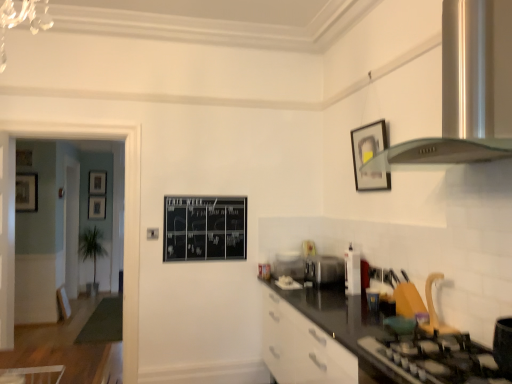
This screenshot has height=384, width=512. In order to click on wooden picture frame at left, which is the 2th picture frame in left-to-right order in this screenshot , I will do `click(26, 192)`.

You are a GUI agent. You are given a task and a screenshot of the screen. Output one action in this format:
    pyautogui.click(x=<x>, y=<y>)
    Task: Click on the black chalkboard at center
    This screenshot has height=384, width=512.
    Given the screenshot: What is the action you would take?
    pyautogui.click(x=205, y=228)

Describe the element at coordinates (97, 207) in the screenshot. I see `matte black picture frame at center, the 2th picture frame positioned from the back` at that location.

Locate an element on the screen. The height and width of the screenshot is (384, 512). satin silver exhaust hood at upper right is located at coordinates (467, 89).

You are a GUI agent. You are given a task and a screenshot of the screen. Output one action in this format:
    pyautogui.click(x=<x>, y=<y>)
    Task: Click on the matte black picture frame at upper right, marked as the 5th picture frame in a left-to-right arrangement
    The height and width of the screenshot is (384, 512).
    Given the screenshot: What is the action you would take?
    pyautogui.click(x=370, y=156)

At what (x,y) coordinates should I click in order to perform the action: click on matte black picture frame at upper left, marked as the first picture frame in a back-to-front arrangement. Please return your answer as a coordinate pair (x, y). This screenshot has height=384, width=512. Looking at the image, I should click on (97, 182).

Where is `wooden picture frame at left, which is the 2th picture frame in left-to-right order`? wooden picture frame at left, which is the 2th picture frame in left-to-right order is located at coordinates (26, 192).

Is white glossy toaster at right, placed as the first appliance when sorted from front to back, beside matte black picture frame at center, the 2th picture frame positioned from the back?

white glossy toaster at right, placed as the first appliance when sorted from front to back, is not next to matte black picture frame at center, the 2th picture frame positioned from the back, and they're not touching.

Based on the photo, from a real-world perspective, is white glossy toaster at right, the first appliance viewed from the right, above or below matte black picture frame at center, the fourth picture frame viewed from the front?

white glossy toaster at right, the first appliance viewed from the right, is situated lower than matte black picture frame at center, the fourth picture frame viewed from the front, in the real world.

Considering the sizes of objects white glossy toaster at right, the 3th appliance when ordered from back to front, and matte black picture frame at center, the second picture frame viewed from the right, in the image provided, who is thinner, white glossy toaster at right, the 3th appliance when ordered from back to front, or matte black picture frame at center, the second picture frame viewed from the right,?

With smaller width is matte black picture frame at center, the second picture frame viewed from the right.

Considering the relative sizes of clear plastic container at center, positioned as the first appliance in left-to-right order, and matte black picture frame at upper right, which ranks as the fifth picture frame in back-to-front order, in the image provided, is clear plastic container at center, positioned as the first appliance in left-to-right order, thinner than matte black picture frame at upper right, which ranks as the fifth picture frame in back-to-front order,?

In fact, clear plastic container at center, positioned as the first appliance in left-to-right order, might be wider than matte black picture frame at upper right, which ranks as the fifth picture frame in back-to-front order.

Is matte black picture frame at upper right, which is the first picture frame from front to back, surrounded by clear plastic container at center, marked as the first appliance in a back-to-front arrangement?

That's incorrect, matte black picture frame at upper right, which is the first picture frame from front to back, is not inside clear plastic container at center, marked as the first appliance in a back-to-front arrangement.

Is matte black picture frame at center, the second picture frame viewed from the right, positioned beyond the bounds of satin silver exhaust hood at upper right?

Yes, matte black picture frame at center, the second picture frame viewed from the right, is outside of satin silver exhaust hood at upper right.

Could you measure the distance between matte black picture frame at center, the fourth picture frame in the left-to-right sequence, and satin silver exhaust hood at upper right?

7.16 meters.

Could you tell me if matte black picture frame at center, the fourth picture frame in the left-to-right sequence, is turned towards satin silver exhaust hood at upper right?

Yes, matte black picture frame at center, the fourth picture frame in the left-to-right sequence, is oriented towards satin silver exhaust hood at upper right.

From their relative heights in the image, would you say matte black picture frame at center, the fourth picture frame in the left-to-right sequence, is taller or shorter than satin silver exhaust hood at upper right?

Considering their sizes, matte black picture frame at center, the fourth picture frame in the left-to-right sequence, has less height than satin silver exhaust hood at upper right.

Is point (319, 279) less distant than point (386, 130)?

No, it is not.

Measure the distance between satin silver toaster at center, the 2th appliance when ordered from right to left, and matte black picture frame at upper right, the 1th picture frame when ordered from right to left.

satin silver toaster at center, the 2th appliance when ordered from right to left, is 29.54 inches away from matte black picture frame at upper right, the 1th picture frame when ordered from right to left.

From the image's perspective, is satin silver toaster at center, which ranks as the 2th appliance in back-to-front order, under matte black picture frame at upper right, marked as the 5th picture frame in a left-to-right arrangement?

Yes.

Are satin silver toaster at center, the second appliance viewed from the front, and matte black picture frame at upper right, the 1th picture frame when ordered from right to left, far apart?

satin silver toaster at center, the second appliance viewed from the front, is near matte black picture frame at upper right, the 1th picture frame when ordered from right to left, not far away.

Does black chalkboard at center come behind white glossy toaster at right, placed as the first appliance when sorted from front to back?

That is True.

From a real-world perspective, is black chalkboard at center over white glossy toaster at right, placed as the first appliance when sorted from front to back?

Yes, from a real-world perspective, black chalkboard at center is on top of white glossy toaster at right, placed as the first appliance when sorted from front to back.

Is black chalkboard at center to the right of white glossy toaster at right, placed as the first appliance when sorted from front to back, from the viewer's perspective?

Incorrect, black chalkboard at center is not on the right side of white glossy toaster at right, placed as the first appliance when sorted from front to back.

Is black chalkboard at center next to white glossy toaster at right, the 3th appliance when ordered from back to front?

No, black chalkboard at center is not with white glossy toaster at right, the 3th appliance when ordered from back to front.

Considering the points (351, 252) and (442, 346), which point is in front, point (351, 252) or point (442, 346)?

The point (442, 346) is in front.

This screenshot has width=512, height=384. Identify the location of gas stove located in front of the white glossy toaster at right, placed as the first appliance when sorted from front to back. (435, 359).

Considering the positions of objects white glossy toaster at right, the first appliance viewed from the right, and black matte gas stove at lower right in the image provided, who is more to the left, white glossy toaster at right, the first appliance viewed from the right, or black matte gas stove at lower right?

white glossy toaster at right, the first appliance viewed from the right.

From their relative heights in the image, would you say wooden picture frame at left, which is counted as the 3th picture frame, starting from the front, is taller or shorter than white glossy toaster at right, placed as the first appliance when sorted from front to back?

Considering their sizes, wooden picture frame at left, which is counted as the 3th picture frame, starting from the front, has less height than white glossy toaster at right, placed as the first appliance when sorted from front to back.

Is white glossy toaster at right, placed as the first appliance when sorted from front to back, surrounded by wooden picture frame at left, positioned as the 5th picture frame in right-to-left order?

Definitely not — white glossy toaster at right, placed as the first appliance when sorted from front to back, is not inside wooden picture frame at left, positioned as the 5th picture frame in right-to-left order.

Is wooden picture frame at left, positioned as the 5th picture frame in right-to-left order, wider or thinner than white glossy toaster at right, the 3th appliance when ordered from back to front?

In the image, wooden picture frame at left, positioned as the 5th picture frame in right-to-left order, appears to be more narrow than white glossy toaster at right, the 3th appliance when ordered from back to front.

How different are the orientations of wooden picture frame at left, which is counted as the 3th picture frame, starting from the front, and white glossy toaster at right, the first appliance viewed from the right, in degrees?

86.6 degrees.

The image size is (512, 384). Find the location of `the 1st picture frame above the white glossy toaster at right, placed as the first appliance when sorted from front to back (from the image's perspective)`. the 1st picture frame above the white glossy toaster at right, placed as the first appliance when sorted from front to back (from the image's perspective) is located at coordinates (97, 207).

Locate an element on the screen. appliance that is the 2nd one below the matte black picture frame at upper right, which is the first picture frame from front to back (from a real-world perspective) is located at coordinates (289, 265).

Looking at the image, which one is located closer to white glossy toaster at right, placed as the first appliance when sorted from front to back, wooden picture frame at left, arranged as the first picture frame when viewed from the left, or matte black picture frame at upper left, the 5th picture frame when ordered from front to back?

The object closer to white glossy toaster at right, placed as the first appliance when sorted from front to back, is wooden picture frame at left, arranged as the first picture frame when viewed from the left.

Which object lies nearer to the anchor point matte black picture frame at upper left, the 5th picture frame when ordered from front to back, white glossy toaster at right, the 3th appliance when ordered from back to front, or black chalkboard at center?

The object closer to matte black picture frame at upper left, the 5th picture frame when ordered from front to back, is black chalkboard at center.

Which object lies further to the anchor point wooden picture frame at left, marked as the fourth picture frame in a right-to-left arrangement, satin silver toaster at center, the 2th appliance when ordered from right to left, or wooden picture frame at left, arranged as the first picture frame when viewed from the left?

satin silver toaster at center, the 2th appliance when ordered from right to left.

Which object lies nearer to the anchor point satin silver exhaust hood at upper right, matte black picture frame at upper right, which ranks as the fifth picture frame in back-to-front order, or white glossy toaster at right, the 3th appliance when ordered from back to front?

The object closer to satin silver exhaust hood at upper right is matte black picture frame at upper right, which ranks as the fifth picture frame in back-to-front order.

Which object lies further to the anchor point matte black picture frame at center, the 2th picture frame positioned from the back, clear plastic container at center, the third appliance in the right-to-left sequence, or white glossy toaster at right, placed as the first appliance when sorted from front to back?

white glossy toaster at right, placed as the first appliance when sorted from front to back.

Estimate the real-world distances between objects in this image. Which object is closer to black chalkboard at center, black matte gas stove at lower right or satin silver exhaust hood at upper right?

black matte gas stove at lower right.

Based on their spatial positions, is matte black picture frame at center, the fourth picture frame viewed from the front, or satin silver exhaust hood at upper right closer to matte black picture frame at upper left, marked as the first picture frame in a back-to-front arrangement?

The object closer to matte black picture frame at upper left, marked as the first picture frame in a back-to-front arrangement, is matte black picture frame at center, the fourth picture frame viewed from the front.

Which object lies further to the anchor point matte black picture frame at center, the fourth picture frame in the left-to-right sequence, wooden picture frame at left, which is counted as the 3th picture frame, starting from the front, or white glossy toaster at right, the third appliance when ordered from left to right?

Among the two, white glossy toaster at right, the third appliance when ordered from left to right, is located further to matte black picture frame at center, the fourth picture frame in the left-to-right sequence.

You are a GUI agent. You are given a task and a screenshot of the screen. Output one action in this format:
    pyautogui.click(x=<x>, y=<y>)
    Task: Click on the bulletin board located between wooden picture frame at left, marked as the fourth picture frame in a right-to-left arrangement, and matte black picture frame at upper right, the 1th picture frame when ordered from right to left, in the left-right direction
    
    Given the screenshot: What is the action you would take?
    pyautogui.click(x=205, y=228)

Identify the location of picture frame between black matte gas stove at lower right and clear plastic container at center, marked as the first appliance in a back-to-front arrangement, in the front-back direction. (370, 156).

The width and height of the screenshot is (512, 384). Find the location of `picture frame between satin silver exhaust hood at upper right and clear plastic container at center, positioned as the first appliance in left-to-right order, in the front-back direction`. picture frame between satin silver exhaust hood at upper right and clear plastic container at center, positioned as the first appliance in left-to-right order, in the front-back direction is located at coordinates (370, 156).

Where is `appliance located between wooden picture frame at left, which is the 2th picture frame in left-to-right order, and satin silver toaster at center, the 2th appliance when ordered from right to left, in the left-right direction`? The height and width of the screenshot is (384, 512). appliance located between wooden picture frame at left, which is the 2th picture frame in left-to-right order, and satin silver toaster at center, the 2th appliance when ordered from right to left, in the left-right direction is located at coordinates (289, 265).